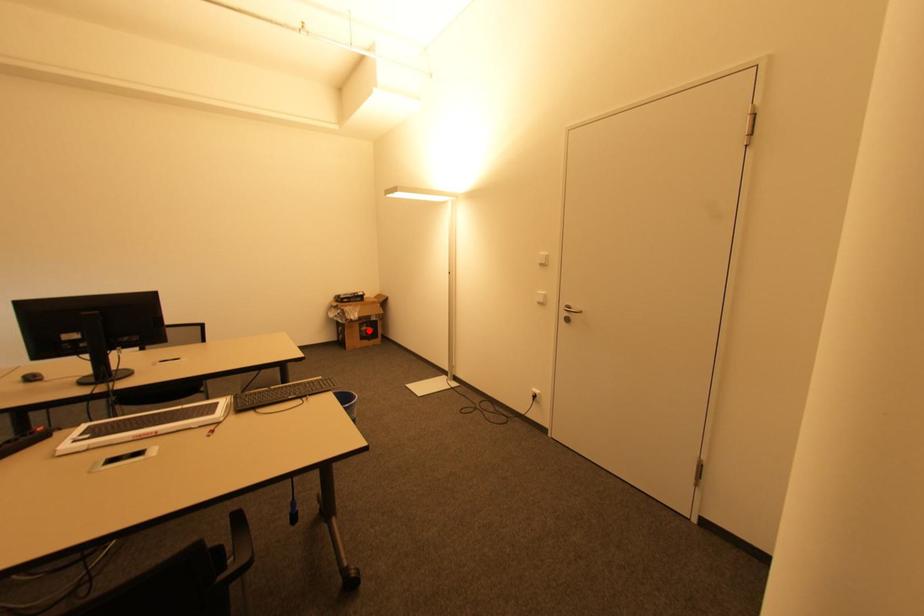
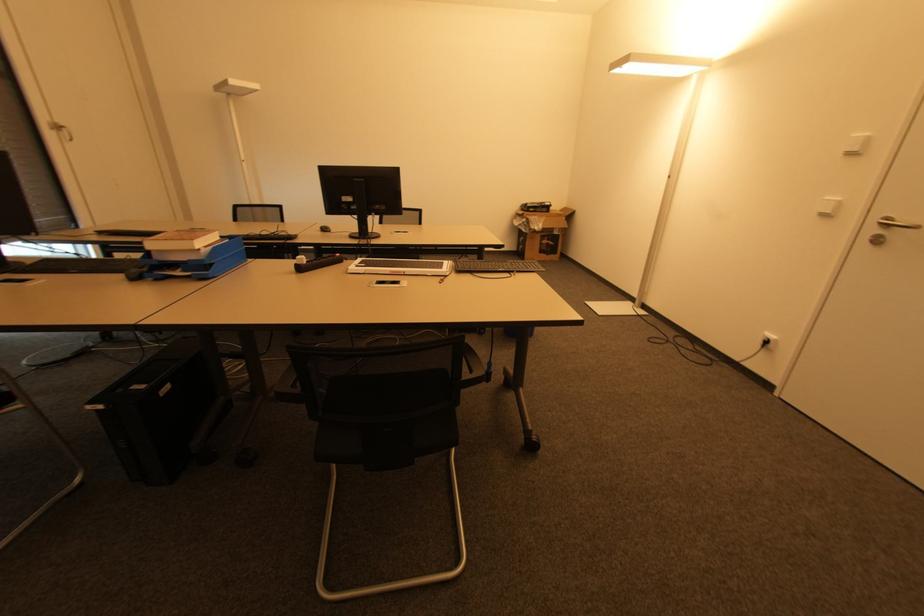
Where in the second image is the point corresponding to the highlighted location from the first image?

(550, 245)